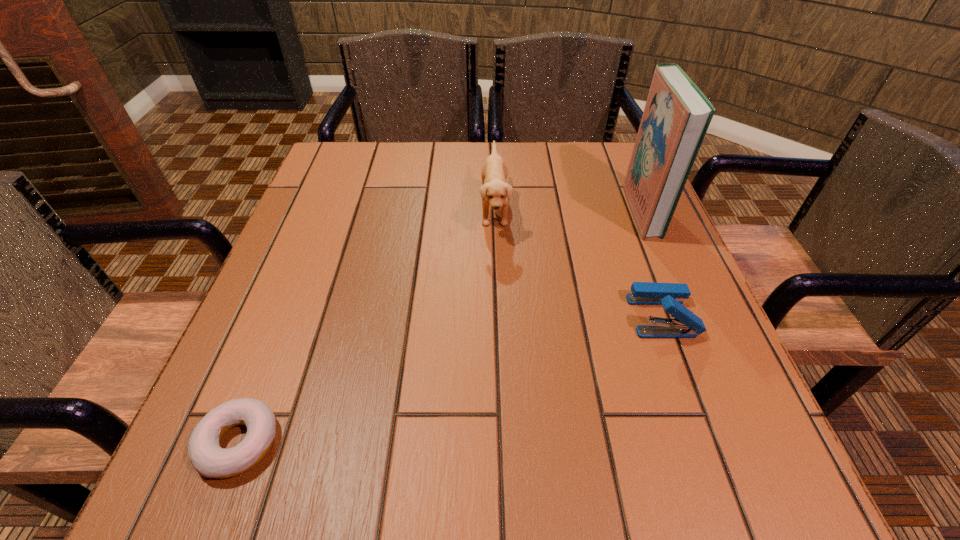
You are a GUI agent. You are given a task and a screenshot of the screen. Output one action in this format:
    pyautogui.click(x=<x>, y=<y>)
    Task: Click on the vacant area that lies between the shortest object and the hardback book
    
    Given the screenshot: What is the action you would take?
    pyautogui.click(x=441, y=326)

The height and width of the screenshot is (540, 960). Identify the location of free spot between the tallest object and the second shortest object. (652, 263).

You are a GUI agent. You are given a task and a screenshot of the screen. Output one action in this format:
    pyautogui.click(x=<x>, y=<y>)
    Task: Click on the free spot between the puppy and the stapler
    Image resolution: width=960 pixels, height=540 pixels.
    Given the screenshot: What is the action you would take?
    pyautogui.click(x=578, y=262)

At what (x,y) coordinates should I click in order to perform the action: click on free space between the second object from left to right and the nearest object. Please return your answer as a coordinate pair (x, y). Looking at the image, I should click on (367, 326).

The width and height of the screenshot is (960, 540). I want to click on vacant space in between the hardback book and the shortest object, so click(441, 326).

Where is `vacant area between the doughnut and the second nearest object`? vacant area between the doughnut and the second nearest object is located at coordinates (450, 379).

You are a GUI agent. You are given a task and a screenshot of the screen. Output one action in this format:
    pyautogui.click(x=<x>, y=<y>)
    Task: Click on the empty location between the second tallest object and the hardback book
    This screenshot has height=540, width=960.
    Given the screenshot: What is the action you would take?
    pyautogui.click(x=568, y=210)

Find the location of a particular element. Image resolution: width=960 pixels, height=540 pixels. vacant space that's between the puppy and the second shortest object is located at coordinates (578, 262).

Locate an element on the screen. Image resolution: width=960 pixels, height=540 pixels. free point between the third tallest object and the hardback book is located at coordinates (652, 263).

This screenshot has width=960, height=540. I want to click on unoccupied position between the third tallest object and the tallest object, so 652,263.